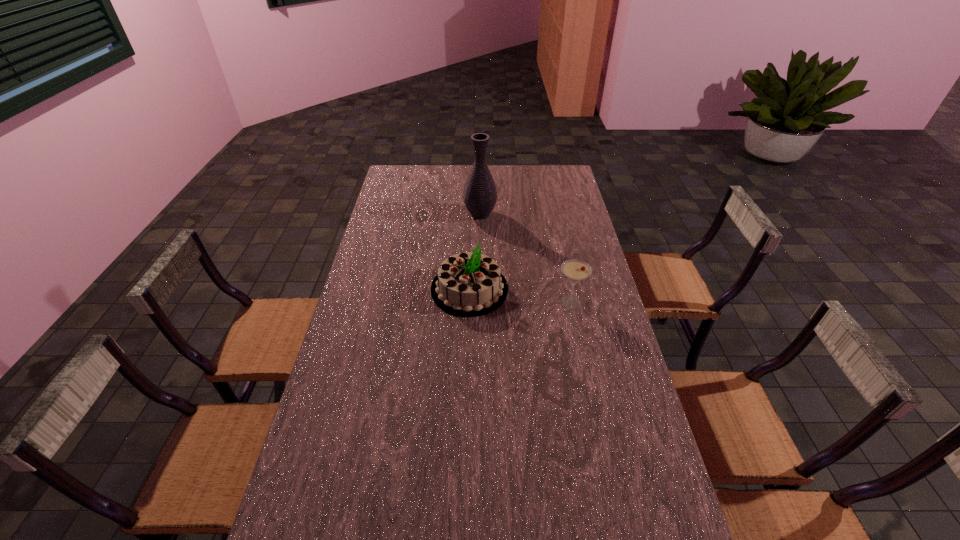
At what (x,y) coordinates should I click in order to perform the action: click on vacant space at the right edge of the desktop. Please return your answer as a coordinate pair (x, y). This screenshot has width=960, height=540. Looking at the image, I should click on (601, 364).

Identify the location of blank space at the far left corner of the desktop. (411, 181).

At what (x,y) coordinates should I click in order to perform the action: click on vacant space at the far right corner of the desktop. Please return your answer as a coordinate pair (x, y). The width and height of the screenshot is (960, 540). Looking at the image, I should click on (564, 170).

The image size is (960, 540). Find the location of `free spot between the shortest object and the birthday cake`. free spot between the shortest object and the birthday cake is located at coordinates (519, 296).

Locate an element on the screen. vacant area that lies between the martini and the birthday cake is located at coordinates (519, 296).

Find the location of a particular element. object that can be found as the second closest to the martini is located at coordinates (480, 194).

Select which object appears as the second closest to the rightmost object. Please provide its 2D coordinates. Your answer should be formatted as a tuple, i.e. [(x, y)], where the tuple contains the x and y coordinates of a point satisfying the conditions above.

[(480, 194)]

Where is `vacant position in the image that satisfies the following two spatial constraints: 1. on the front side of the shortest object; 2. on the left side of the birthday cake`? The width and height of the screenshot is (960, 540). vacant position in the image that satisfies the following two spatial constraints: 1. on the front side of the shortest object; 2. on the left side of the birthday cake is located at coordinates (469, 302).

Identify the location of vacant area in the image that satisfies the following two spatial constraints: 1. on the back side of the farthest object; 2. on the left side of the birthday cake. (471, 214).

The height and width of the screenshot is (540, 960). Identify the location of vacant region that satisfies the following two spatial constraints: 1. on the front side of the birthday cake; 2. on the right side of the martini. (469, 302).